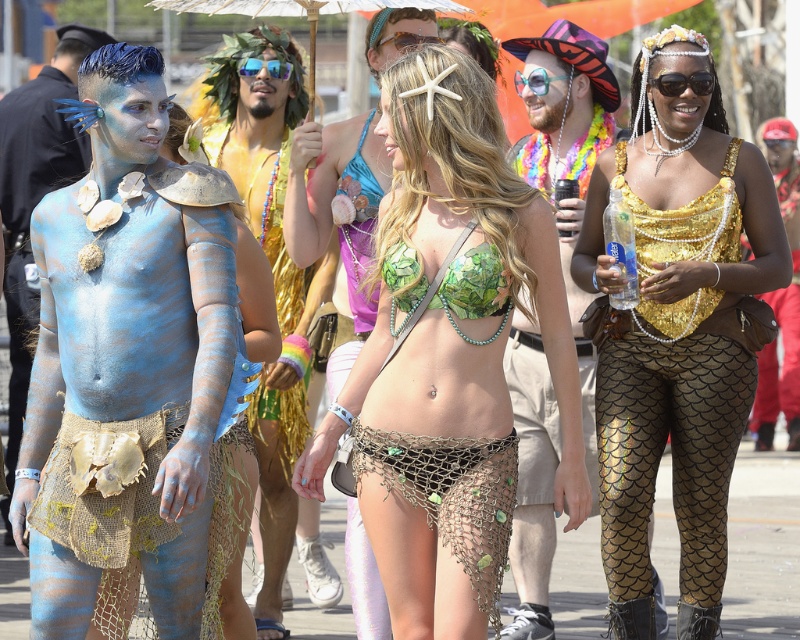
Is white paper umbrella at upper center to the left of blue reflective sunglasses at center from the viewer's perspective?

Incorrect, white paper umbrella at upper center is not on the left side of blue reflective sunglasses at center.

Is point (210, 13) positioned behind point (282, 61)?

No.

You are a GUI agent. You are given a task and a screenshot of the screen. Output one action in this format:
    pyautogui.click(x=<x>, y=<y>)
    Task: Click on the white paper umbrella at upper center
    The image size is (800, 640).
    Given the screenshot: What is the action you would take?
    pyautogui.click(x=302, y=13)

Looking at this image, can you confirm if gold sequined top at center is positioned to the left of black plastic sunglasses at upper right?

Correct, you'll find gold sequined top at center to the left of black plastic sunglasses at upper right.

Is gold sequined top at center wider than black plastic sunglasses at upper right?

Correct, the width of gold sequined top at center exceeds that of black plastic sunglasses at upper right.

Where is `gold sequined top at center`? The image size is (800, 640). gold sequined top at center is located at coordinates (676, 330).

Does gold sequined top at center have a smaller size compared to white paper umbrella at upper center?

No.

Which of these two, gold sequined top at center or white paper umbrella at upper center, stands taller?

gold sequined top at center

Describe the element at coordinates (676, 330) in the screenshot. I see `gold sequined top at center` at that location.

Where is `gold sequined top at center`? The height and width of the screenshot is (640, 800). gold sequined top at center is located at coordinates (676, 330).